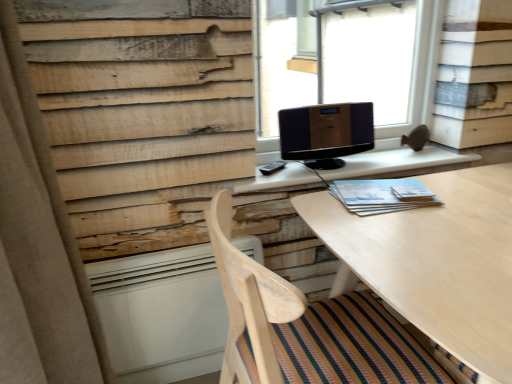
At what (x,y) coordinates should I click in order to perform the action: click on free space to the left of light blue paper at right. Please return your answer as a coordinate pair (x, y). Looking at the image, I should click on (317, 206).